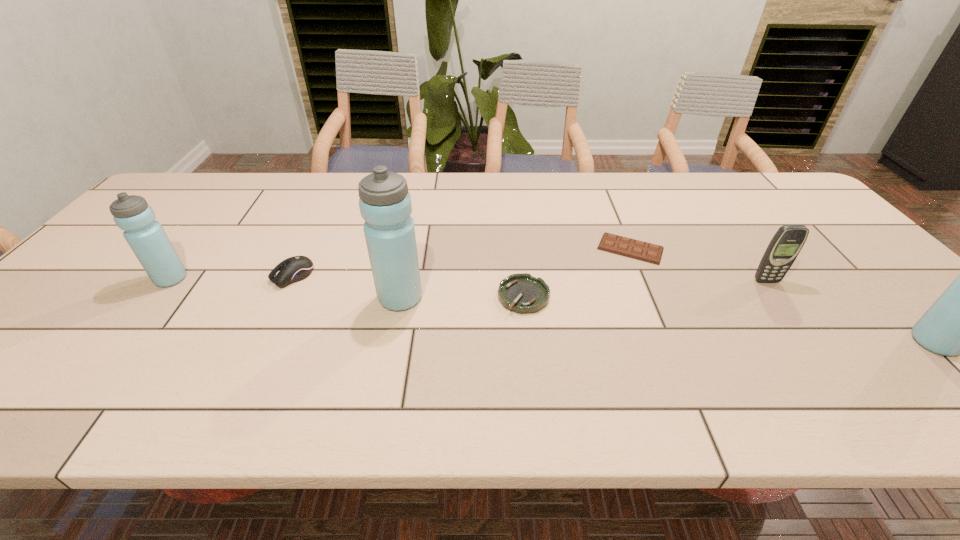
In order to click on the fourth object from right to left in this screenshot , I will do `click(522, 293)`.

You are a GUI agent. You are given a task and a screenshot of the screen. Output one action in this format:
    pyautogui.click(x=<x>, y=<y>)
    Task: Click on the vacant area situated on the right of the third tallest object
    
    Given the screenshot: What is the action you would take?
    pyautogui.click(x=209, y=279)

In order to click on free space located 0.250m on the right of the third object from left to right in this screenshot , I will do `click(525, 298)`.

This screenshot has height=540, width=960. I want to click on vacant space located on the left of the fifth object from left to right, so click(525, 248).

You are a GUI agent. You are given a task and a screenshot of the screen. Output one action in this format:
    pyautogui.click(x=<x>, y=<y>)
    Task: Click on the vacant region located on the screen of the fourth tallest object
    
    Given the screenshot: What is the action you would take?
    pyautogui.click(x=818, y=351)

Locate an element on the screen. This screenshot has height=540, width=960. free space located 0.390m on the back of the fifth tallest object is located at coordinates (335, 189).

Identify the location of vacant region located 0.360m on the left of the fourth object from right to left. The width and height of the screenshot is (960, 540). (351, 296).

You are a GUI agent. You are given a task and a screenshot of the screen. Output one action in this format:
    pyautogui.click(x=<x>, y=<y>)
    Task: Click on the free point at the far edge
    
    Given the screenshot: What is the action you would take?
    pyautogui.click(x=549, y=183)

What are the coordinates of `vacant point at the near edge` in the screenshot? It's located at (852, 340).

Find the location of a particular element. This screenshot has height=540, width=960. vacant area at the left edge is located at coordinates (75, 299).